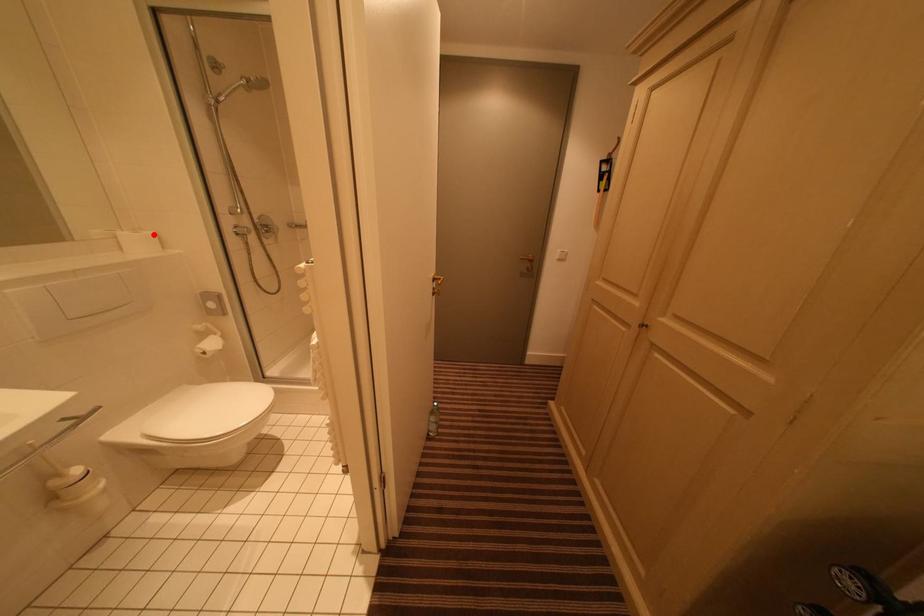
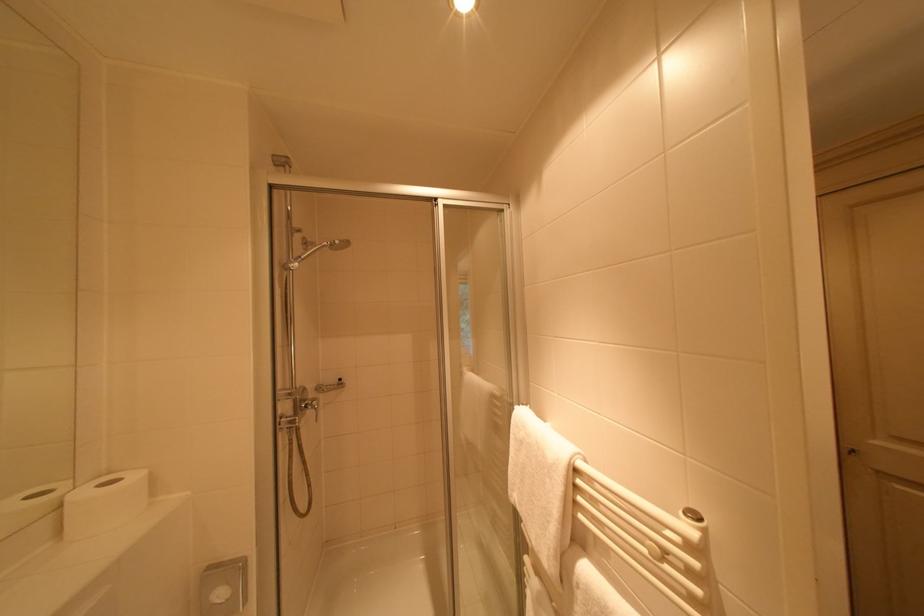
In the second image, find the point that corresponds to the highlighted location in the first image.

(140, 479)